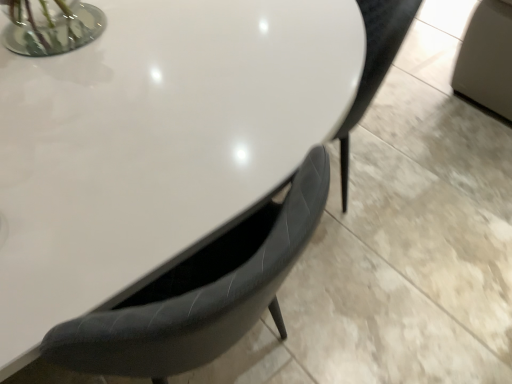
This screenshot has height=384, width=512. I want to click on white glossy table at center, so click(x=155, y=144).

What is the approximate width of white glossy table at center?

white glossy table at center is 61.67 centimeters wide.

In order to face white glossy table at center, should I rotate leftwards or rightwards?

Rotate your view left by about 9.725°.

What do you see at coordinates (155, 144) in the screenshot? I see `white glossy table at center` at bounding box center [155, 144].

Identify the location of white glossy table at center. (155, 144).